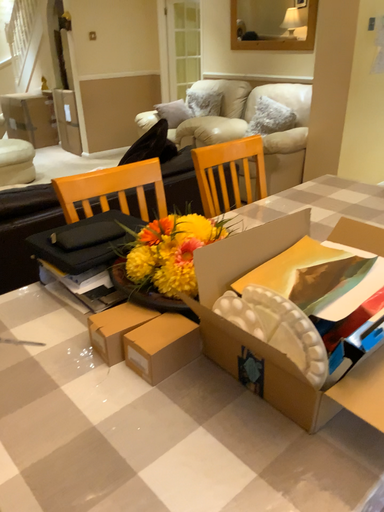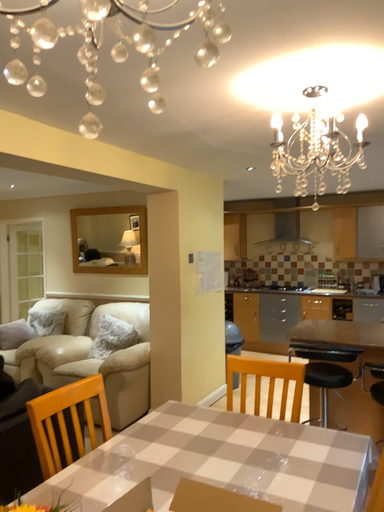
Question: Which way did the camera rotate in the video?

Choices:
 (A) rotated upward
 (B) rotated downward

Answer: (A)